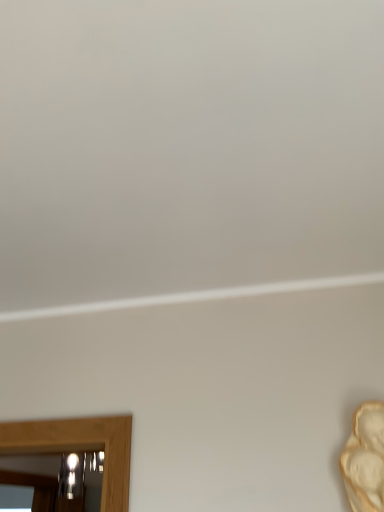
Identify the location of metallic reflective mirror at lower left. The image size is (384, 512). (32, 463).

The height and width of the screenshot is (512, 384). Describe the element at coordinates (32, 463) in the screenshot. I see `metallic reflective mirror at lower left` at that location.

Image resolution: width=384 pixels, height=512 pixels. Describe the element at coordinates (365, 458) in the screenshot. I see `white plaster mask at right` at that location.

Locate an element on the screen. This screenshot has width=384, height=512. white plaster mask at right is located at coordinates (365, 458).

You are a GUI agent. You are given a task and a screenshot of the screen. Output one action in this format:
    pyautogui.click(x=<x>, y=<y>)
    Task: Click on the metallic reflective mirror at lower left
    
    Given the screenshot: What is the action you would take?
    pyautogui.click(x=32, y=463)

Which object is positioned more to the left, metallic reflective mirror at lower left or white plaster mask at right?

Positioned to the left is metallic reflective mirror at lower left.

Considering the positions of objects metallic reflective mirror at lower left and white plaster mask at right in the image provided, who is behind, metallic reflective mirror at lower left or white plaster mask at right?

metallic reflective mirror at lower left is further away from the camera.

Does point (97, 510) lie in front of point (378, 441)?

That is False.

From the image's perspective, is metallic reflective mirror at lower left below white plaster mask at right?

Indeed, from the image's perspective, metallic reflective mirror at lower left is shown beneath white plaster mask at right.

From a real-world perspective, relative to white plaster mask at right, is metallic reflective mirror at lower left vertically above or below?

Clearly, from a real-world perspective, metallic reflective mirror at lower left is above white plaster mask at right.

Can you confirm if metallic reflective mirror at lower left is wider than white plaster mask at right?

Yes, metallic reflective mirror at lower left is wider than white plaster mask at right.

Which of these two, metallic reflective mirror at lower left or white plaster mask at right, stands taller?

white plaster mask at right is taller.

Is metallic reflective mirror at lower left bigger than white plaster mask at right?

Yes, metallic reflective mirror at lower left is bigger than white plaster mask at right.

Does metallic reflective mirror at lower left contain white plaster mask at right?

Actually, white plaster mask at right is outside metallic reflective mirror at lower left.

Is metallic reflective mirror at lower left directly adjacent to white plaster mask at right?

No, metallic reflective mirror at lower left is not with white plaster mask at right.

Is metallic reflective mirror at lower left oriented away from white plaster mask at right?

No, metallic reflective mirror at lower left's orientation is not away from white plaster mask at right.

How many degrees apart are the facing directions of metallic reflective mirror at lower left and white plaster mask at right?

They differ by 0.904 degrees in their facing directions.

How far apart are metallic reflective mirror at lower left and white plaster mask at right?

metallic reflective mirror at lower left is 2.65 meters from white plaster mask at right.

Find the location of a particular element. The width and height of the screenshot is (384, 512). person above the metallic reflective mirror at lower left (from the image's perspective) is located at coordinates (365, 458).

Between white plaster mask at right and metallic reflective mirror at lower left, which one appears on the left side from the viewer's perspective?

From the viewer's perspective, metallic reflective mirror at lower left appears more on the left side.

Considering their positions, is white plaster mask at right located in front of or behind metallic reflective mirror at lower left?

In the image, white plaster mask at right appears in front of metallic reflective mirror at lower left.

Which is farther from the camera, [374,483] or [90,489]?

Positioned behind is point [90,489].

Based on the photo, from the image's perspective, is white plaster mask at right below metallic reflective mirror at lower left?

No, from the image's perspective, white plaster mask at right is not below metallic reflective mirror at lower left.

From a real-world perspective, between white plaster mask at right and metallic reflective mirror at lower left, who is vertically higher?

metallic reflective mirror at lower left, from a real-world perspective.

Considering the relative sizes of white plaster mask at right and metallic reflective mirror at lower left in the image provided, is white plaster mask at right thinner than metallic reflective mirror at lower left?

Correct, the width of white plaster mask at right is less than that of metallic reflective mirror at lower left.

Can you confirm if white plaster mask at right is taller than metallic reflective mirror at lower left?

Yes.

Does white plaster mask at right have a smaller size compared to metallic reflective mirror at lower left?

Indeed, white plaster mask at right has a smaller size compared to metallic reflective mirror at lower left.

Would you say white plaster mask at right contains metallic reflective mirror at lower left?

That's incorrect, metallic reflective mirror at lower left is not inside white plaster mask at right.

Is white plaster mask at right beside metallic reflective mirror at lower left?

No, white plaster mask at right is not next to metallic reflective mirror at lower left.

Is metallic reflective mirror at lower left at the back of white plaster mask at right?

No.

How many degrees apart are the facing directions of white plaster mask at right and metallic reflective mirror at lower left?

The angle between the facing direction of white plaster mask at right and the facing direction of metallic reflective mirror at lower left is 0.904 degrees.

Find the location of a particular element. The width and height of the screenshot is (384, 512). mirror located on the left of white plaster mask at right is located at coordinates (32, 463).

Image resolution: width=384 pixels, height=512 pixels. Find the location of `mirror on the left of white plaster mask at right`. mirror on the left of white plaster mask at right is located at coordinates pyautogui.click(x=32, y=463).

Locate an element on the screen. This screenshot has height=512, width=384. person above the metallic reflective mirror at lower left (from the image's perspective) is located at coordinates (365, 458).